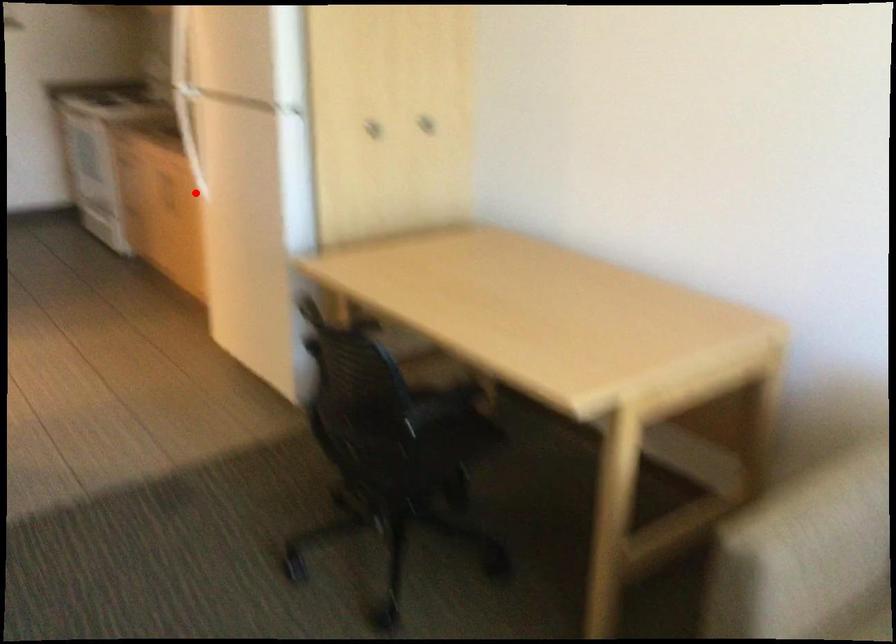
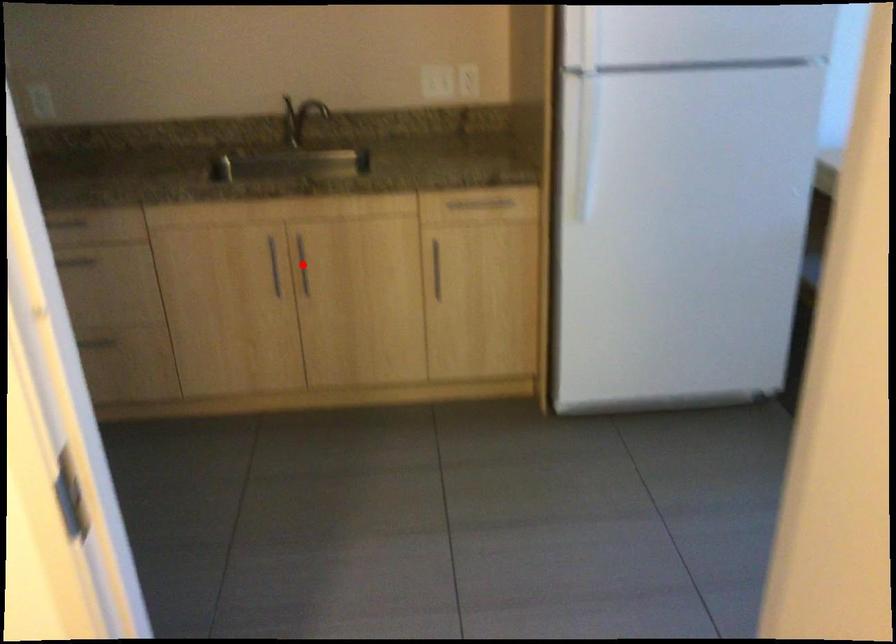
I am providing you with two images of the same scene from different viewpoints. A red point is marked on the first image and another point is marked on the second image. Do the highlighted points in image1 and image2 indicate the same real-world spot?

Yes